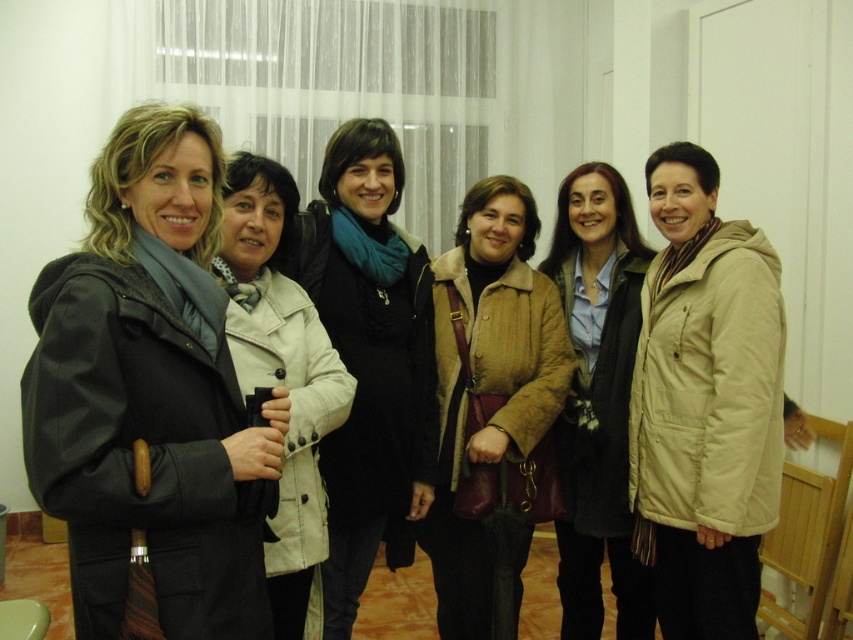
You are organizing a photoshoot and need to arrange the beige cotton jacket at center and the matte beige coat at center in a way that follows the current positioning. Which jacket should be placed to the left to maintain the existing layout?

The matte beige coat at center should be placed to the left to maintain the existing layout, as the beige cotton jacket at center is currently on its right side.

You are a photographer trying to arrange the beige cotton jacket at center and the matte beige coat at center on a mannequin. Since the mannequin has limited space, you need to know which item takes up more horizontal space. Which one is wider?

The beige cotton jacket at center is wider than the matte beige coat at center, so it takes up more horizontal space.